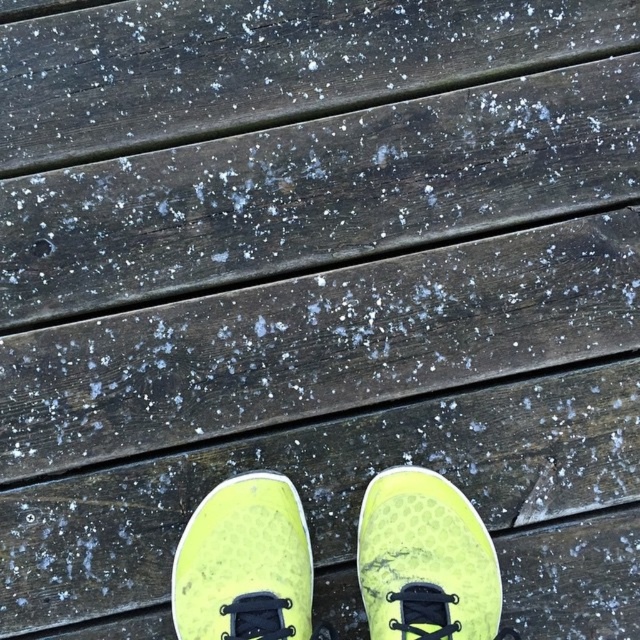
You are trying to fit both the neon yellow fabric shoe at center and the neon yellow mesh shoe at center into a small storage box. Based on their sizes, which one might be harder to fit?

The neon yellow mesh shoe at center might be harder to fit into the small storage box because it occupies more space than the neon yellow fabric shoe at center.

You are standing 4.36 feet away from the point marked at coordinates point (433, 493). The shoes are placed on a wooden deck. Can you see the shoes from your current position?

Yes, because the point marked at coordinates point 0.777, 0.677 is 4.36 feet away from you, and the shoes are placed on the wooden deck, so you can see them from that distance.

You are a delivery robot with a 15 cm wide package. You need to place the package between the neon yellow fabric shoe at center and the neon yellow mesh shoe at center. Is there enough space between them to fit the package?

The neon yellow fabric shoe at center and neon yellow mesh shoe at center are 12.41 centimeters apart from each other. Since the package is 15 cm wide, there isn not enough space to fit the package between them.